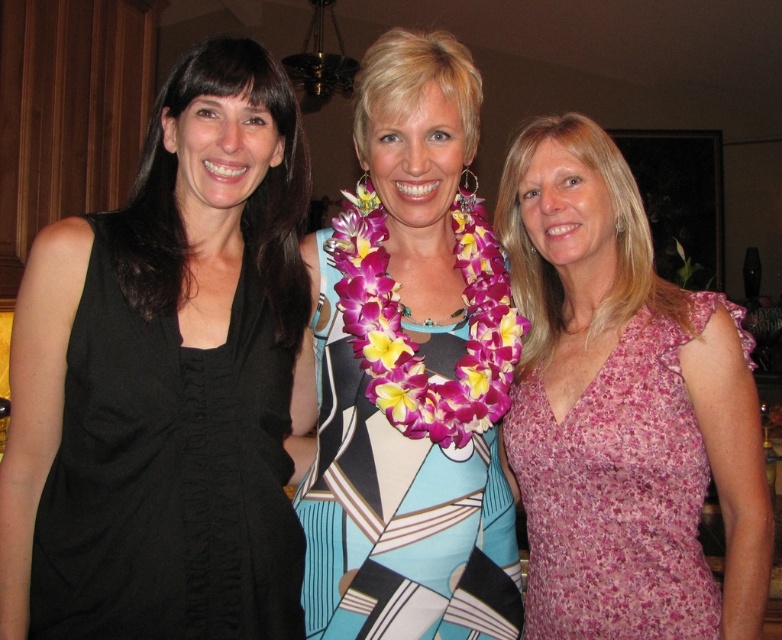
You are a photographer trying to capture a closeup of the printed fabric dress at center and the floral lei at center. If your camera can only focus on objects within 3 inches of each other, will you be able to get both in focus?

The distance between the printed fabric dress at center and the floral lei at center is 3.75 inches, which is greater than the 3 inches required for focus. Therefore, you cannot get both in focus at the same time.

You are a photographer standing 1.5 meters away from the camera. You want to take a photo of the pink floral dress at right. Can you move closer to the dress without exceeding the camera distance limit?

The distance between the pink floral dress at right and the camera is 1.27 meters. Since you are currently 1.5 meters away from the camera, moving closer would require reducing your distance to less than 1.27 meters. However, the camera distance limit isn not specified, so it depends on whether the limit allows being within 1.27 meters. Without knowing the limit, I cannot confirm if it exceeds.

You are a photographer trying to adjust the composition of this group photo. You notice the pink floral dress at right and the printed fabric dress at center. Which dress appears narrower in the photo?

The pink floral dress at right has a lesser width compared to the printed fabric dress at center, so it appears narrower in the photo.